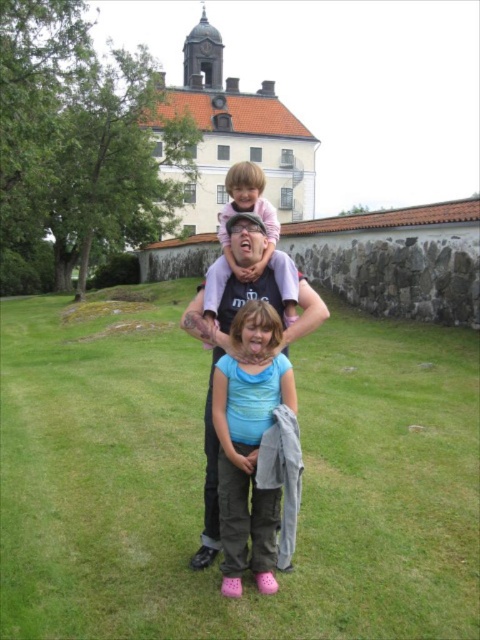
Question: Is matte blue shirt at center below pink fabric at upper center?

Choices:
 (A) yes
 (B) no

Answer: (A)

Question: Which point is closer to the camera taking this photo?

Choices:
 (A) (269, 250)
 (B) (332, 586)
 (C) (217, 534)

Answer: (B)

Question: Can you confirm if green grass at center is smaller than matte blue shirt at center?

Choices:
 (A) no
 (B) yes

Answer: (A)

Question: Is matte blue shirt at center to the right of pink fabric at upper center from the viewer's perspective?

Choices:
 (A) yes
 (B) no

Answer: (A)

Question: Considering the real-world distances, which object is farthest from the matte blue shirt at center?

Choices:
 (A) pink fabric at upper center
 (B) black cotton t-shirt at center
 (C) green grass at center

Answer: (A)

Question: Which object is farther from the camera taking this photo?

Choices:
 (A) black cotton t-shirt at center
 (B) pink fabric at upper center
 (C) matte blue shirt at center

Answer: (B)